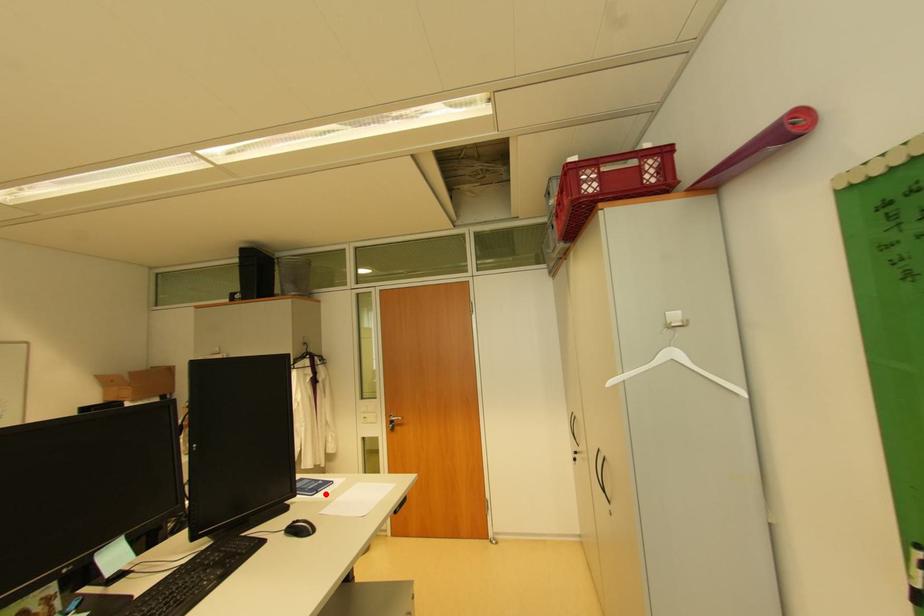
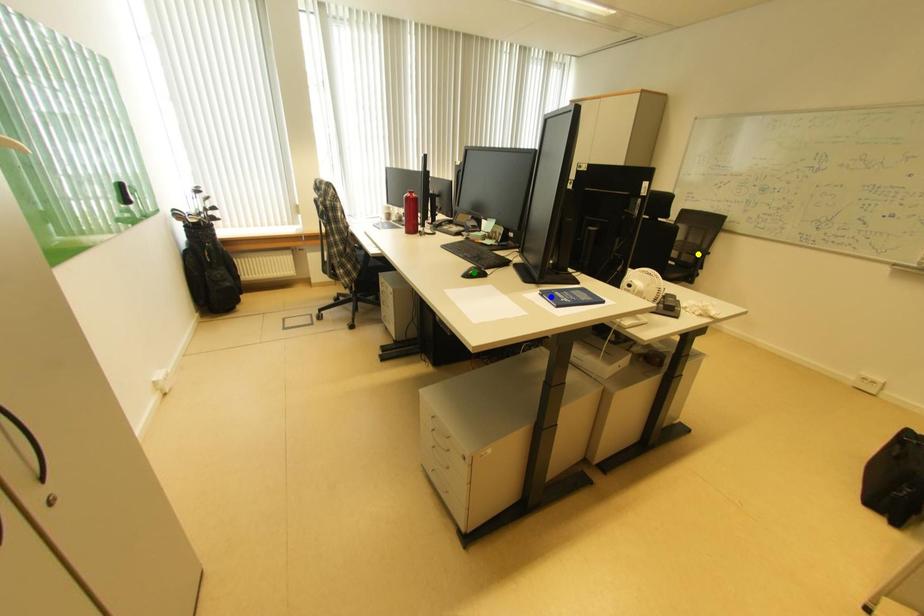
Question: I am providing you with two images of the same scene from different viewpoints. A red point is marked on the first image. You are given multiple points on the second image. Which point in image 2 is actually the same real-world point as the red point in image 1?

Choices:
 (A) blue point
 (B) yellow point
 (C) green point

Answer: (A)